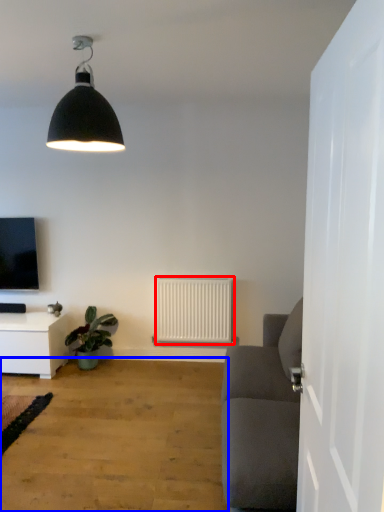
Question: Which of the following is the closest to the observer, radiator (highlighted by a red box) or plain (highlighted by a blue box)?

Choices:
 (A) radiator
 (B) plain

Answer: (B)